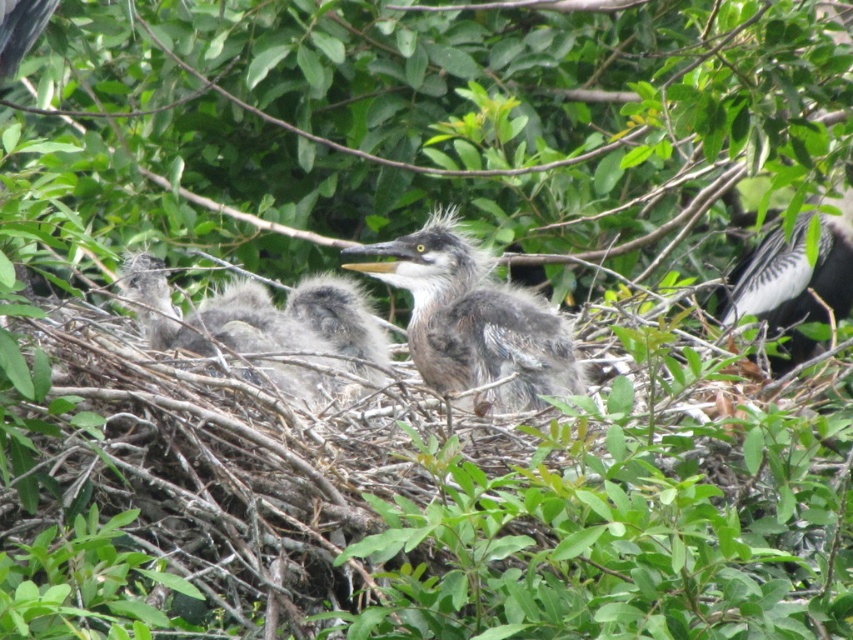
Question: Based on their relative distances, which object is farther from the gray fluffy bird at center?

Choices:
 (A) gray fluffy nestling at center
 (B) gray-white feathers at right

Answer: (B)

Question: Estimate the real-world distances between objects in this image. Which object is closer to the gray fluffy bird at center?

Choices:
 (A) gray-white feathers at right
 (B) gray fluffy nestling at center

Answer: (B)

Question: Observing the image, what is the correct spatial positioning of gray fluffy bird at center in reference to gray-white feathers at right?

Choices:
 (A) above
 (B) below

Answer: (B)

Question: Is gray fluffy bird at center to the right of gray fluffy nestling at center from the viewer's perspective?

Choices:
 (A) no
 (B) yes

Answer: (B)

Question: Estimate the real-world distances between objects in this image. Which object is farther from the gray fluffy nestling at center?

Choices:
 (A) gray-white feathers at right
 (B) gray fluffy bird at center

Answer: (A)

Question: Is gray fluffy bird at center to the left of gray-white feathers at right from the viewer's perspective?

Choices:
 (A) no
 (B) yes

Answer: (B)